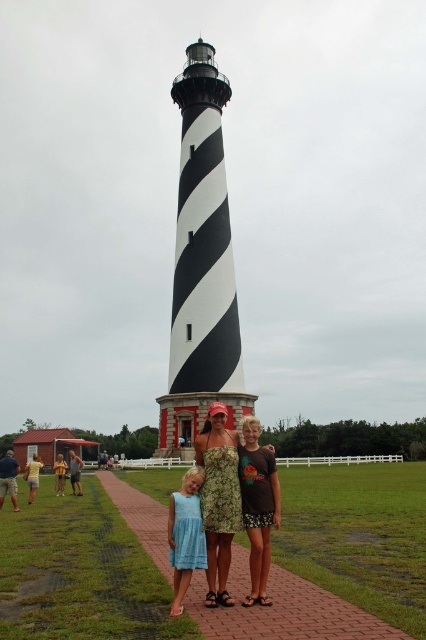
Question: Can you confirm if floral dress at center is smaller than matte floral dress at center?

Choices:
 (A) no
 (B) yes

Answer: (A)

Question: Which point is closer to the camera taking this photo?

Choices:
 (A) (222, 602)
 (B) (184, 499)

Answer: (A)

Question: Which point is closer to the camera taking this photo?

Choices:
 (A) (98, 461)
 (B) (175, 593)

Answer: (B)

Question: Is light blue fabric dress at center smaller than matte floral dress at center?

Choices:
 (A) no
 (B) yes

Answer: (A)

Question: Among these points, which one is nearest to the camera?

Choices:
 (A) [221, 516]
 (B) [183, 516]

Answer: (B)

Question: Is floral dress at center wider than light blue fabric dress at center?

Choices:
 (A) yes
 (B) no

Answer: (A)